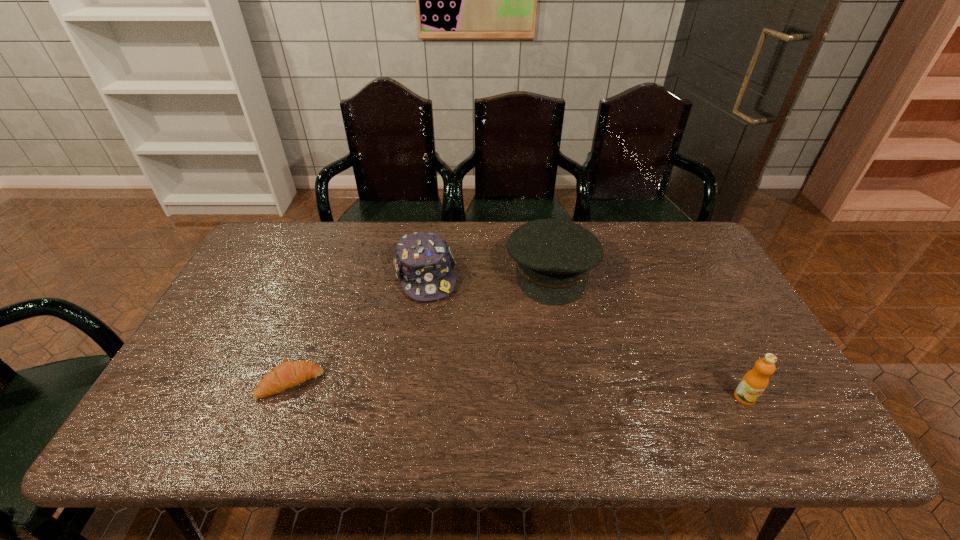
Locate an element on the screen. The height and width of the screenshot is (540, 960). vacant region at the near edge of the desktop is located at coordinates tap(491, 399).

The height and width of the screenshot is (540, 960). I want to click on vacant space at the left edge of the desktop, so click(211, 379).

The width and height of the screenshot is (960, 540). In order to click on free region at the far left corner of the desktop in this screenshot , I will do `click(302, 238)`.

At what (x,y) coordinates should I click in order to perform the action: click on free location at the far right corner of the desktop. Please return your answer as a coordinate pair (x, y). Looking at the image, I should click on [670, 227].

The image size is (960, 540). In order to click on empty space that is in between the second shortest object and the third object from left to right in this screenshot , I will do `click(489, 273)`.

What are the coordinates of `vacant space that is in between the shortest object and the orange juice` in the screenshot? It's located at (517, 390).

Locate an element on the screen. The width and height of the screenshot is (960, 540). vacant area that lies between the rightmost object and the beret is located at coordinates (648, 334).

Find the location of a particular element. The width and height of the screenshot is (960, 540). free spot between the rightmost object and the beret is located at coordinates (648, 334).

Identify the location of free space between the beret and the rightmost object. (648, 334).

The height and width of the screenshot is (540, 960). I want to click on vacant point located between the second object from left to right and the second object from right to left, so click(x=489, y=273).